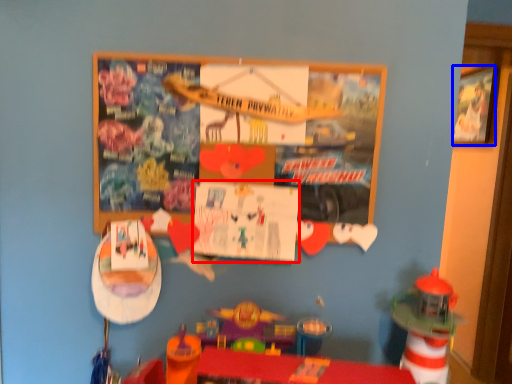
Question: Which point is further to the camera, poster page (highlighted by a red box) or picture frame (highlighted by a blue box)?

Choices:
 (A) poster page
 (B) picture frame

Answer: (B)